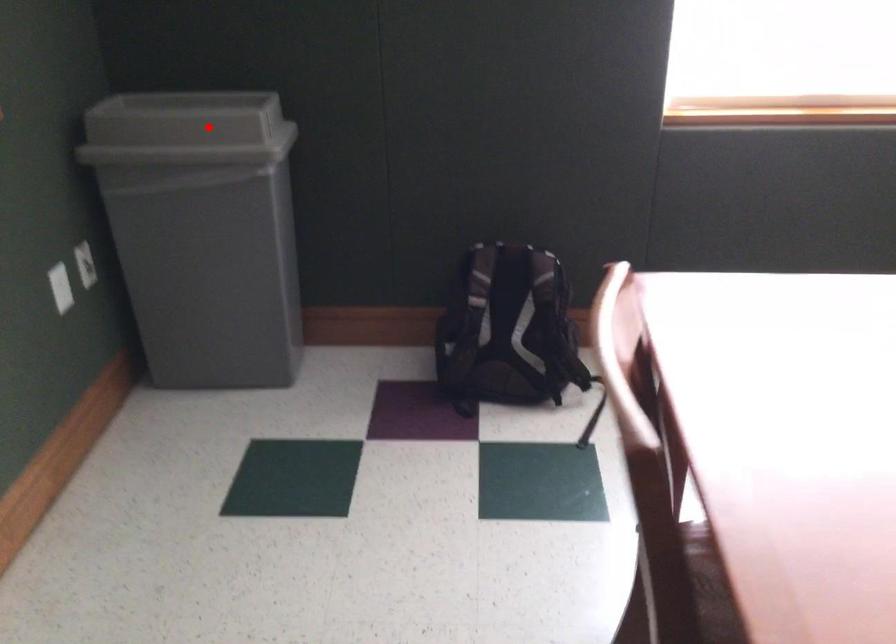
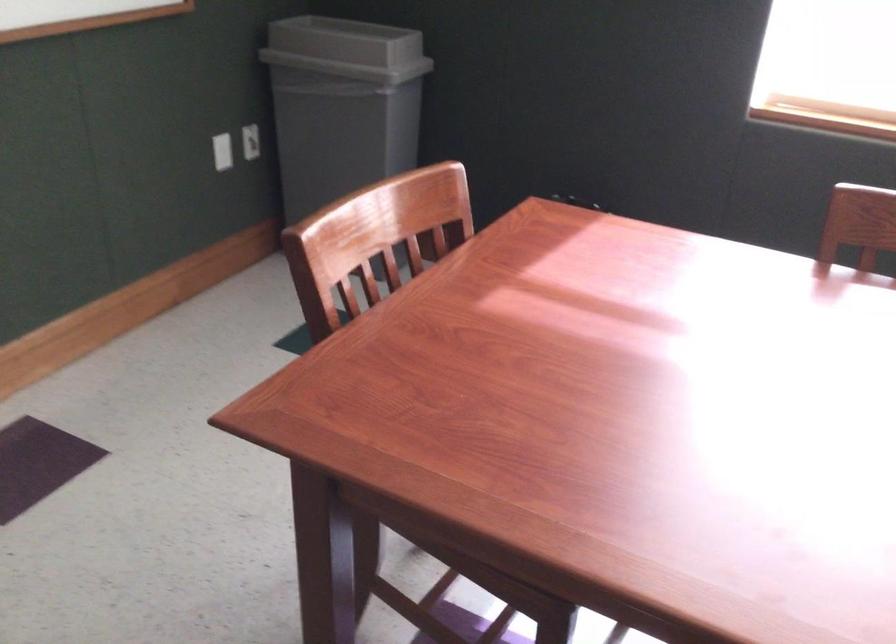
Where in the second image is the point corresponding to the highlighted location from the first image?

(346, 49)